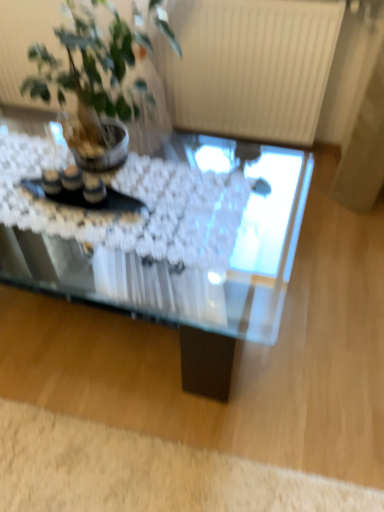
Question: Is white fluffy rug at lower left turned away from transparent glass coffee table at center?

Choices:
 (A) yes
 (B) no

Answer: (A)

Question: Is the position of white fluffy rug at lower left less distant than that of transparent glass coffee table at center?

Choices:
 (A) yes
 (B) no

Answer: (B)

Question: Is white fluffy rug at lower left bigger than transparent glass coffee table at center?

Choices:
 (A) no
 (B) yes

Answer: (A)

Question: Is white fluffy rug at lower left wider than transparent glass coffee table at center?

Choices:
 (A) no
 (B) yes

Answer: (A)

Question: Is white fluffy rug at lower left smaller than transparent glass coffee table at center?

Choices:
 (A) yes
 (B) no

Answer: (A)

Question: Is white fluffy rug at lower left far from transparent glass coffee table at center?

Choices:
 (A) yes
 (B) no

Answer: (B)

Question: Does white fluffy rug at lower left have a greater height compared to green leafy plant at upper left?

Choices:
 (A) yes
 (B) no

Answer: (B)

Question: Considering the relative sizes of white fluffy rug at lower left and green leafy plant at upper left in the image provided, is white fluffy rug at lower left bigger than green leafy plant at upper left?

Choices:
 (A) yes
 (B) no

Answer: (B)

Question: Is white fluffy rug at lower left further to camera compared to green leafy plant at upper left?

Choices:
 (A) no
 (B) yes

Answer: (B)

Question: Can you confirm if white fluffy rug at lower left is positioned to the right of green leafy plant at upper left?

Choices:
 (A) yes
 (B) no

Answer: (A)

Question: Does white fluffy rug at lower left have a greater width compared to green leafy plant at upper left?

Choices:
 (A) no
 (B) yes

Answer: (A)

Question: Is white fluffy rug at lower left positioned far away from green leafy plant at upper left?

Choices:
 (A) no
 (B) yes

Answer: (B)

Question: Can white fluffy rug at lower left be found inside green leafy plant at upper left?

Choices:
 (A) no
 (B) yes

Answer: (A)